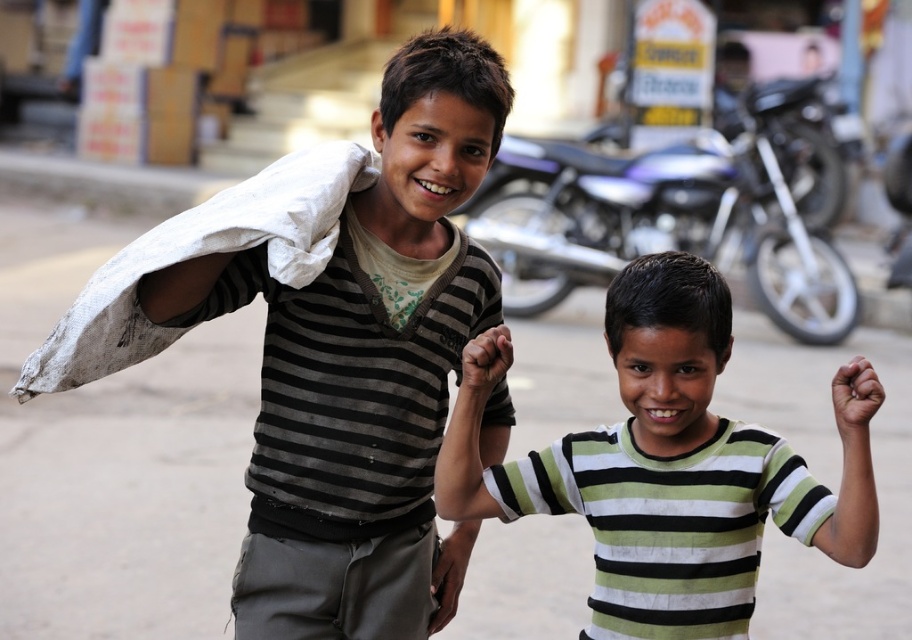
Question: Considering the relative positions of striped cotton shirt at center and white cotton cloth at left in the image provided, where is striped cotton shirt at center located with respect to white cotton cloth at left?

Choices:
 (A) above
 (B) below

Answer: (B)

Question: Does striped cotton shirt at center have a lesser width compared to white cotton cloth at left?

Choices:
 (A) yes
 (B) no

Answer: (B)

Question: Which object is the farthest from the green striped shirt at center?

Choices:
 (A) striped cotton shirt at center
 (B) white cotton cloth at left

Answer: (B)

Question: Estimate the real-world distances between objects in this image. Which object is farther from the striped cotton shirt at center?

Choices:
 (A) green striped shirt at center
 (B) white cotton cloth at left

Answer: (A)

Question: Which object is closer to the camera taking this photo?

Choices:
 (A) white cotton cloth at left
 (B) striped cotton shirt at center

Answer: (A)

Question: In this image, where is green striped shirt at center located relative to metallic blue motorcycle at upper center?

Choices:
 (A) below
 (B) above

Answer: (A)